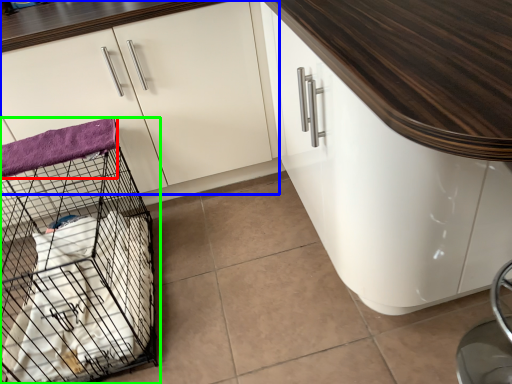
Question: Which object is positioned farthest from blanket (highlighted by a red box)? Select from cabinetry (highlighted by a blue box) and bird cage (highlighted by a green box).

Choices:
 (A) cabinetry
 (B) bird cage

Answer: (B)